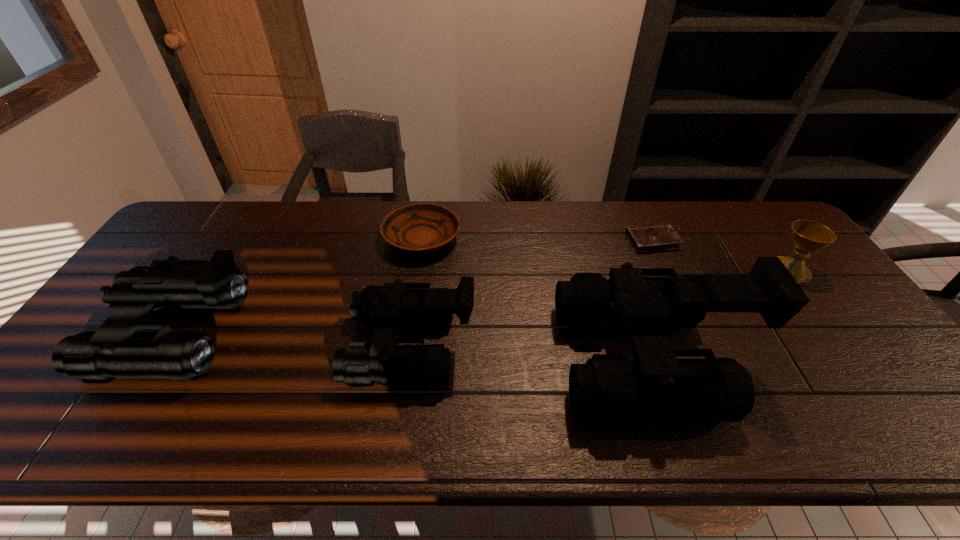
Find the location of `vacant space located 0.220m on the front lenses of the third tallest object`. vacant space located 0.220m on the front lenses of the third tallest object is located at coordinates (263, 346).

Locate an element on the screen. blank space located 0.220m on the front lenses of the third tallest object is located at coordinates (263, 346).

Image resolution: width=960 pixels, height=540 pixels. Identify the location of blank space located on the front lenses of the third tallest object. [x=330, y=346].

Image resolution: width=960 pixels, height=540 pixels. I want to click on vacant space located on the front lenses of the rightmost binoculars, so click(x=468, y=359).

Locate an element on the screen. free space located 0.270m on the front lenses of the rightmost binoculars is located at coordinates [x=451, y=359].

At what (x,y) coordinates should I click in order to perform the action: click on vacant position located 0.200m on the front lenses of the rightmost binoculars. Please return your answer as a coordinate pair (x, y). This screenshot has height=540, width=960. Looking at the image, I should click on (480, 359).

Where is `free region located on the front of the fifth tallest object`? This screenshot has width=960, height=540. free region located on the front of the fifth tallest object is located at coordinates (405, 352).

This screenshot has height=540, width=960. I want to click on vacant space located on the back of the rightmost object, so click(771, 244).

The height and width of the screenshot is (540, 960). Identify the location of free space located on the back of the shortest object. (639, 212).

Locate an element on the screen. Image resolution: width=960 pixels, height=540 pixels. plate situated at the far edge is located at coordinates (422, 227).